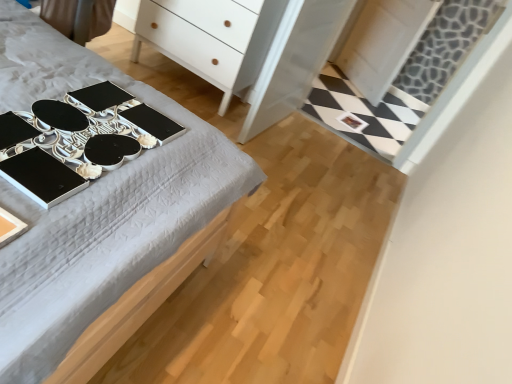
Question: From the image's perspective, is white matte chest of drawers at upper center above white glossy dresser at center?

Choices:
 (A) yes
 (B) no

Answer: (A)

Question: From a real-world perspective, does white matte chest of drawers at upper center stand above white glossy dresser at center?

Choices:
 (A) yes
 (B) no

Answer: (B)

Question: Is white matte chest of drawers at upper center positioned with its back to white glossy dresser at center?

Choices:
 (A) no
 (B) yes

Answer: (A)

Question: Considering the relative sizes of white matte chest of drawers at upper center and white glossy dresser at center in the image provided, is white matte chest of drawers at upper center smaller than white glossy dresser at center?

Choices:
 (A) no
 (B) yes

Answer: (A)

Question: From the image's perspective, is white matte chest of drawers at upper center under white glossy dresser at center?

Choices:
 (A) no
 (B) yes

Answer: (A)

Question: Is white matte chest of drawers at upper center directly adjacent to white glossy dresser at center?

Choices:
 (A) no
 (B) yes

Answer: (A)

Question: From the image's perspective, is metallic silver changing table at upper left beneath white glossy dresser at center?

Choices:
 (A) no
 (B) yes

Answer: (B)

Question: Is the depth of metallic silver changing table at upper left less than that of white glossy dresser at center?

Choices:
 (A) yes
 (B) no

Answer: (A)

Question: Does metallic silver changing table at upper left appear on the right side of white glossy dresser at center?

Choices:
 (A) yes
 (B) no

Answer: (B)

Question: Is metallic silver changing table at upper left not inside white glossy dresser at center?

Choices:
 (A) no
 (B) yes

Answer: (B)

Question: Is metallic silver changing table at upper left further to the viewer compared to white glossy dresser at center?

Choices:
 (A) yes
 (B) no

Answer: (B)

Question: From the image's perspective, is metallic silver changing table at upper left located above white glossy dresser at center?

Choices:
 (A) no
 (B) yes

Answer: (A)

Question: Considering the relative positions of metallic silver changing table at upper left and black glossy desk at upper left in the image provided, is metallic silver changing table at upper left in front of black glossy desk at upper left?

Choices:
 (A) yes
 (B) no

Answer: (A)